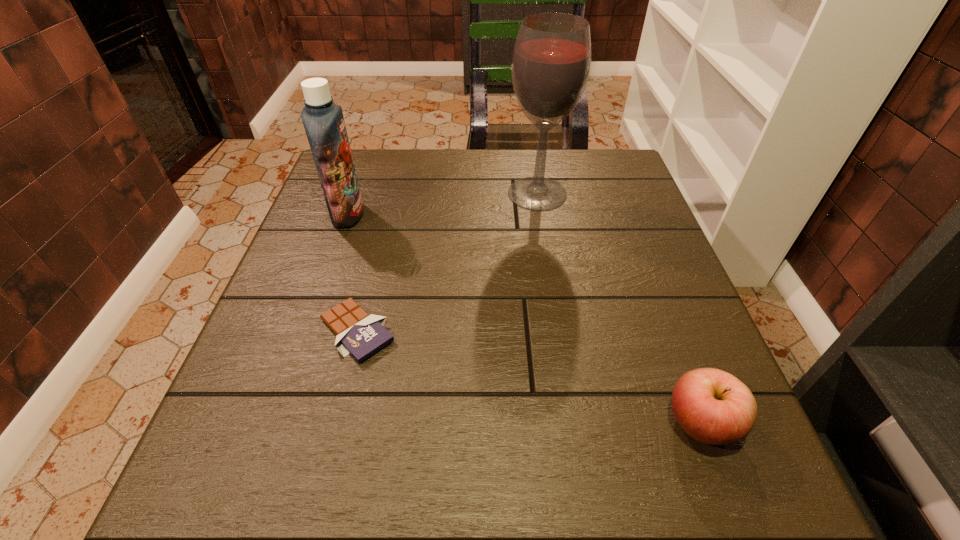
At what (x,y) coordinates should I click in order to perform the action: click on vacant space that's between the apple and the third object from left to right. Please return your answer as a coordinate pair (x, y). This screenshot has height=540, width=960. Looking at the image, I should click on (619, 308).

Select which object appears as the closest to the apple. Please provide its 2D coordinates. Your answer should be formatted as a tuple, i.e. [(x, y)], where the tuple contains the x and y coordinates of a point satisfying the conditions above.

[(361, 335)]

Find the location of `object that stands as the closest to the apple`. object that stands as the closest to the apple is located at coordinates (361, 335).

You are a GUI agent. You are given a task and a screenshot of the screen. Output one action in this format:
    pyautogui.click(x=<x>, y=<y>)
    Task: Click on the free space in the image that satisfies the following two spatial constraints: 1. on the back side of the second nearest object; 2. on the front label of the second tallest object
    
    Given the screenshot: What is the action you would take?
    pyautogui.click(x=386, y=214)

This screenshot has width=960, height=540. What are the coordinates of `free spot that satisfies the following two spatial constraints: 1. on the back side of the alcohol; 2. on the right side of the shortest object` in the screenshot? It's located at (391, 193).

In order to click on free spot that satisfies the following two spatial constraints: 1. on the front label of the apple; 2. on the right side of the second tallest object in this screenshot , I will do `click(276, 423)`.

The width and height of the screenshot is (960, 540). I want to click on free location that satisfies the following two spatial constraints: 1. on the back side of the third farthest object; 2. on the front label of the shampoo, so click(386, 214).